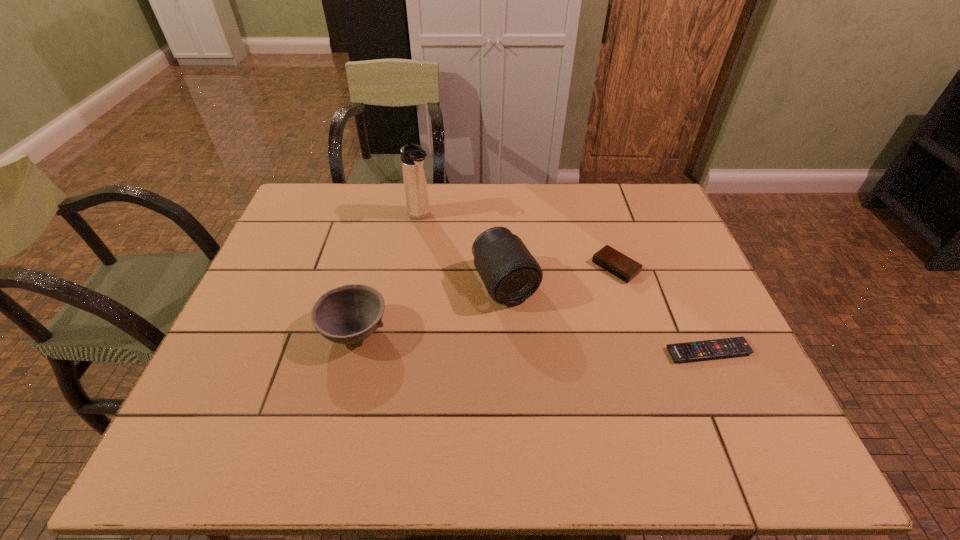
This screenshot has width=960, height=540. In order to click on free space at the far edge of the desktop in this screenshot , I will do `click(545, 198)`.

This screenshot has width=960, height=540. In the image, there is a desktop. In order to click on vacant space at the left edge in this screenshot , I will do `click(276, 365)`.

Where is `blank space at the far left corner`? blank space at the far left corner is located at coordinates 318,187.

In the image, there is a desktop. At what (x,y) coordinates should I click in order to perform the action: click on vacant area at the far right corner. Please return your answer as a coordinate pair (x, y). Looking at the image, I should click on (661, 208).

You are a GUI agent. You are given a task and a screenshot of the screen. Output one action in this format:
    pyautogui.click(x=<x>, y=<y>)
    Task: Click on the free space between the second tallest object and the alarm clock
    The height and width of the screenshot is (540, 960).
    Given the screenshot: What is the action you would take?
    pyautogui.click(x=561, y=275)

Where is `vacant space that is in between the remote control and the farthest object`? The width and height of the screenshot is (960, 540). vacant space that is in between the remote control and the farthest object is located at coordinates (564, 284).

Identify the location of vacant area that lies between the thermos bottle and the fourth shortest object. (463, 250).

At what (x,y) coordinates should I click in order to perform the action: click on free space between the farthest object and the fourth shortest object. Please return your answer as a coordinate pair (x, y). Looking at the image, I should click on (463, 250).

At what (x,y) coordinates should I click in order to perform the action: click on free space between the third object from left to right and the thermos bottle. Please return your answer as a coordinate pair (x, y). Looking at the image, I should click on (463, 250).

You are a GUI agent. You are given a task and a screenshot of the screen. Output one action in this format:
    pyautogui.click(x=<x>, y=<y>)
    Task: Click on the free point between the third object from left to right and the remote control
    Image resolution: width=960 pixels, height=540 pixels.
    Given the screenshot: What is the action you would take?
    pyautogui.click(x=607, y=318)